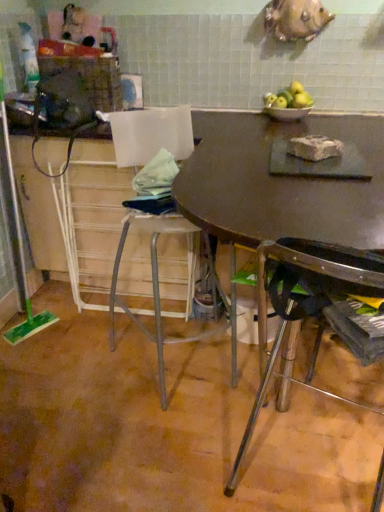
Identify the location of vacant area situated below green matte apples at upper center (from a real-world perspective). (x=286, y=105).